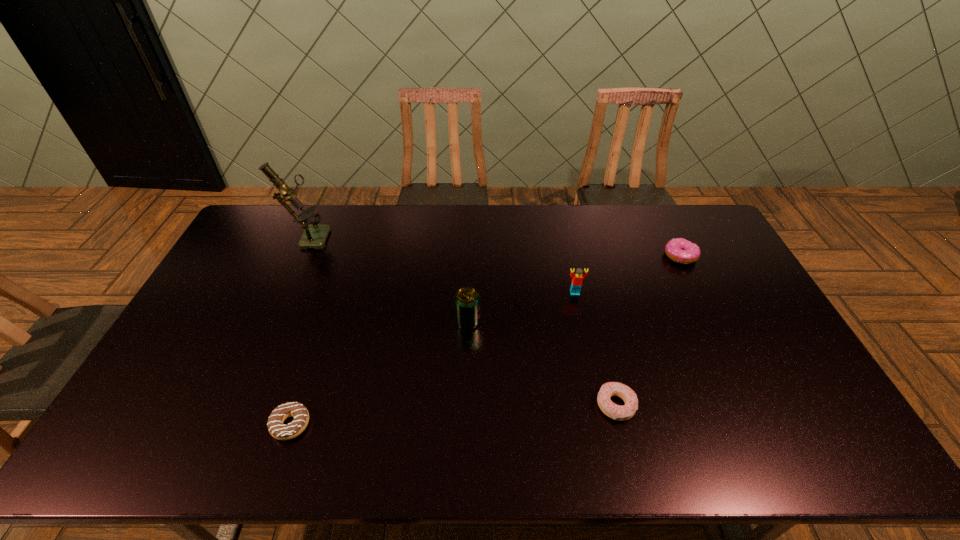
Locate an element on the screen. This screenshot has width=960, height=540. vacant space located on the left of the beer can is located at coordinates (370, 321).

The width and height of the screenshot is (960, 540). Identify the location of blank space located on the face of the third farthest object. (599, 406).

Image resolution: width=960 pixels, height=540 pixels. Find the location of `free point located on the left of the fourth tallest object`. free point located on the left of the fourth tallest object is located at coordinates (576, 256).

Find the location of `free space located on the back of the second doughnut from right to left`. free space located on the back of the second doughnut from right to left is located at coordinates (604, 356).

Find the location of a particular element. free spot located 0.170m on the left of the fifth object from right to left is located at coordinates (204, 424).

Where is `object at the far edge`? Image resolution: width=960 pixels, height=540 pixels. object at the far edge is located at coordinates click(314, 236).

Where is `object present at the near edge`? object present at the near edge is located at coordinates (280, 431).

Image resolution: width=960 pixels, height=540 pixels. Identify the location of object located at the right edge. (679, 250).

In the image, there is a desktop. Identify the location of vacant space at the far edge. The width and height of the screenshot is (960, 540). (576, 234).

This screenshot has height=540, width=960. I want to click on vacant space at the near edge of the desktop, so click(x=622, y=441).